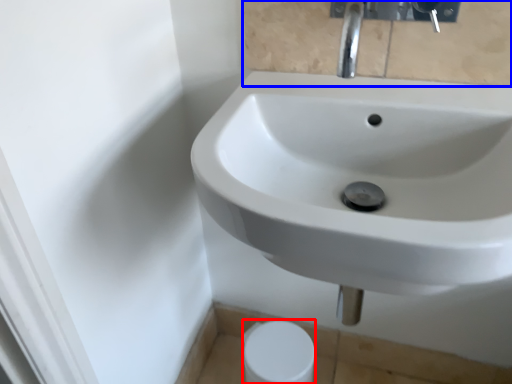
Question: Which point is further to the camera, toilet paper (highlighted by a red box) or mirror (highlighted by a blue box)?

Choices:
 (A) toilet paper
 (B) mirror

Answer: (A)